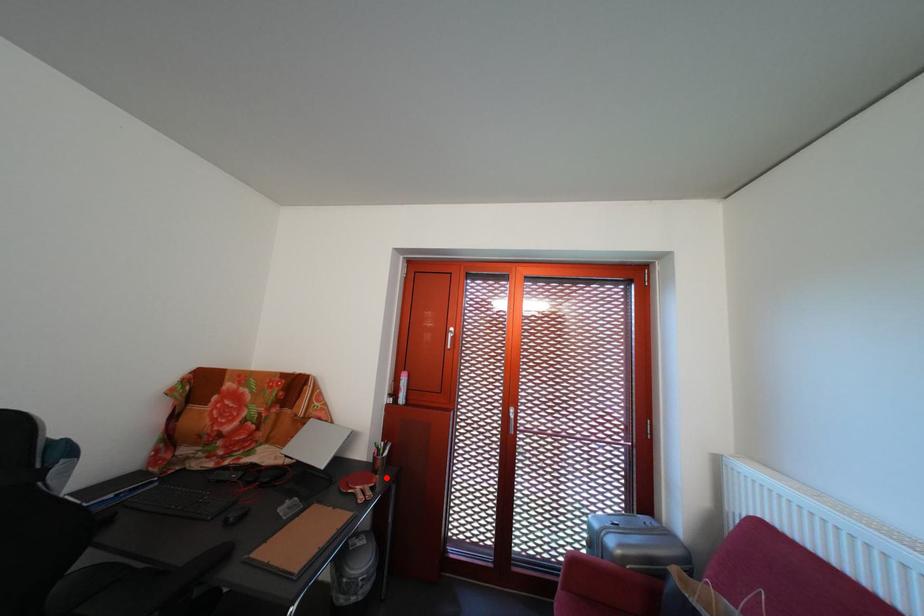
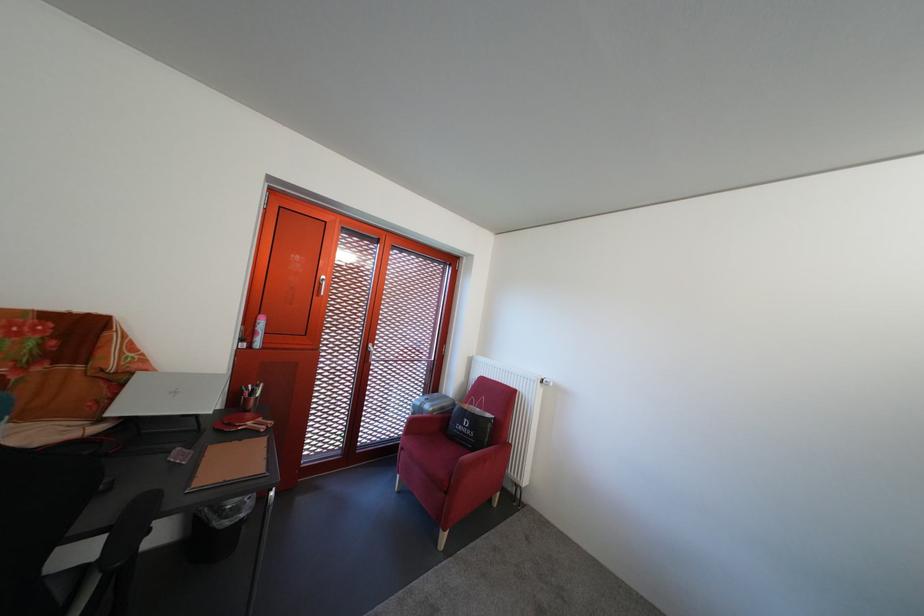
Find the pixel in the second image that matches the highlighted location in the first image.

(260, 418)